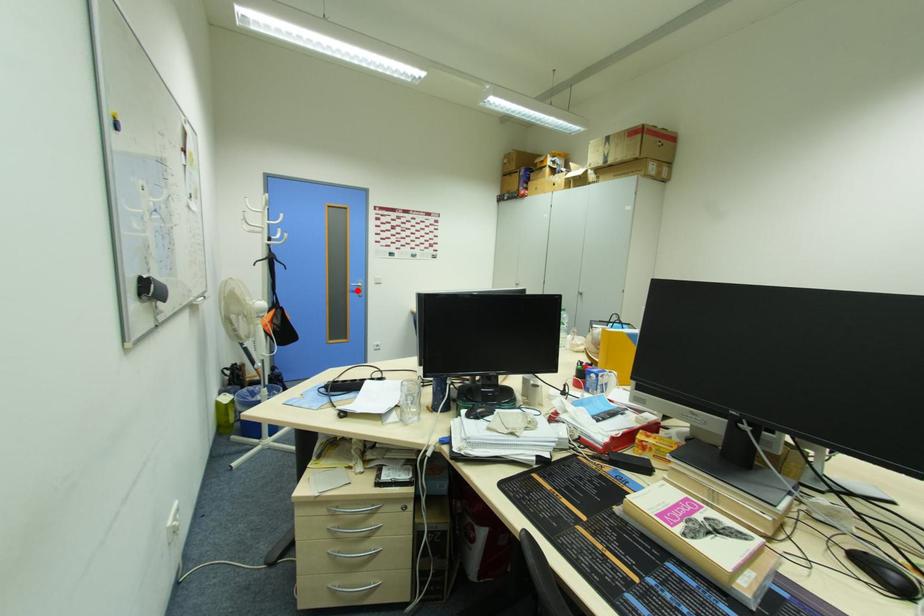
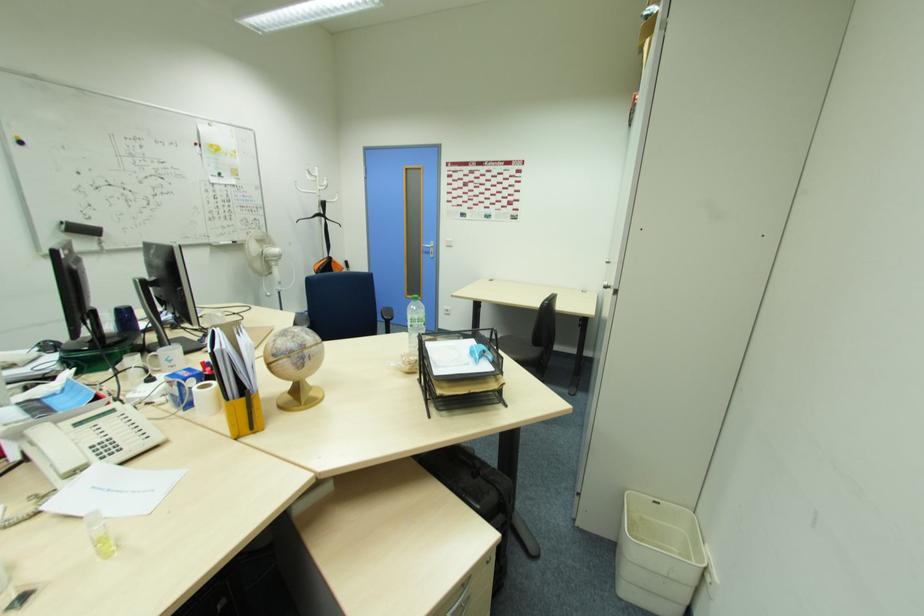
In the second image, find the point that corresponds to the highlighted location in the first image.

(430, 252)